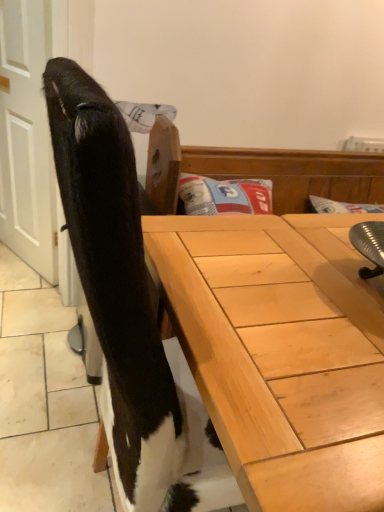
Identify the location of light wood desk at lower right. (280, 354).

What do you see at coordinates (280, 354) in the screenshot? Image resolution: width=384 pixels, height=512 pixels. I see `light wood desk at lower right` at bounding box center [280, 354].

Measure the distance between light wood desk at lower right and camera.

The distance of light wood desk at lower right from camera is 21.01 inches.

What do you see at coordinates (27, 137) in the screenshot?
I see `black matte screen door at left` at bounding box center [27, 137].

What is the approximate width of black matte screen door at left?

4.04 inches.

Where is `black matte screen door at left`? This screenshot has width=384, height=512. black matte screen door at left is located at coordinates (27, 137).

Identify the location of light wood desk at lower right. (280, 354).

Considering the positions of objects black matte screen door at left and light wood desk at lower right in the image provided, who is more to the left, black matte screen door at left or light wood desk at lower right?

black matte screen door at left.

Does black matte screen door at left lie in front of light wood desk at lower right?

No, black matte screen door at left is further to the viewer.

Does point (23, 153) appear closer or farther from the camera than point (246, 488)?

Point (23, 153) appears to be farther away from the viewer than point (246, 488).

From the image's perspective, is black matte screen door at left located above or below light wood desk at lower right?

black matte screen door at left is situated higher than light wood desk at lower right in the image.

From a real-world perspective, which object rests below the other?

In real-world perspective, light wood desk at lower right is lower.

Which of these two, black matte screen door at left or light wood desk at lower right, is thinner?

Thinner between the two is black matte screen door at left.

Is black matte screen door at left shorter than light wood desk at lower right?

No.

Considering the sizes of objects black matte screen door at left and light wood desk at lower right in the image provided, who is bigger, black matte screen door at left or light wood desk at lower right?

light wood desk at lower right.

Is black matte screen door at left not within light wood desk at lower right?

black matte screen door at left is positioned outside light wood desk at lower right.

Is black matte screen door at left positioned far away from light wood desk at lower right?

black matte screen door at left is far away from light wood desk at lower right.

Is black matte screen door at left facing away from light wood desk at lower right?

No, black matte screen door at left is not facing away from light wood desk at lower right.

How many degrees apart are the facing directions of black matte screen door at left and light wood desk at lower right?

The facing directions of black matte screen door at left and light wood desk at lower right are 62.4 degrees apart.

Based on the photo, how distant is black matte screen door at left from light wood desk at lower right?

They are 1.24 meters apart.

The width and height of the screenshot is (384, 512). Identify the location of screen door that is on the left side of light wood desk at lower right. (27, 137).

Considering the positions of objects light wood desk at lower right and black matte screen door at left in the image provided, who is more to the left, light wood desk at lower right or black matte screen door at left?

Positioned to the left is black matte screen door at left.

Between light wood desk at lower right and black matte screen door at left, which one is positioned in front?

light wood desk at lower right is closer to the camera.

Which is closer, (x=327, y=260) or (x=4, y=225)?

Clearly, point (x=327, y=260) is closer to the camera than point (x=4, y=225).

From the image's perspective, which one is positioned lower, light wood desk at lower right or black matte screen door at left?

light wood desk at lower right appears lower in the image.

From a real-world perspective, does light wood desk at lower right stand above black matte screen door at left?

Actually, light wood desk at lower right is physically below black matte screen door at left in the real world.

Looking at their sizes, would you say light wood desk at lower right is wider or thinner than black matte screen door at left?

Considering their sizes, light wood desk at lower right looks broader than black matte screen door at left.

Which of these two, light wood desk at lower right or black matte screen door at left, stands taller?

Standing taller between the two is black matte screen door at left.

Who is bigger, light wood desk at lower right or black matte screen door at left?

light wood desk at lower right.

Which is correct: light wood desk at lower right is inside black matte screen door at left, or outside of it?

light wood desk at lower right lies outside black matte screen door at left.

Is the surface of light wood desk at lower right in direct contact with black matte screen door at left?

They are not placed beside each other.

Is light wood desk at lower right positioned with its back to black matte screen door at left?

Yes.

How different are the orientations of light wood desk at lower right and black matte screen door at left in degrees?

The angular difference between light wood desk at lower right and black matte screen door at left is 62.4 degrees.

How distant is light wood desk at lower right from black matte screen door at left?

A distance of 4.06 feet exists between light wood desk at lower right and black matte screen door at left.

Where is `desk below the black matte screen door at left (from the image's perspective)`? This screenshot has height=512, width=384. desk below the black matte screen door at left (from the image's perspective) is located at coordinates (280, 354).

I want to click on desk below the black matte screen door at left (from a real-world perspective), so click(280, 354).

Identify the location of screen door lying behind the light wood desk at lower right. pos(27,137).